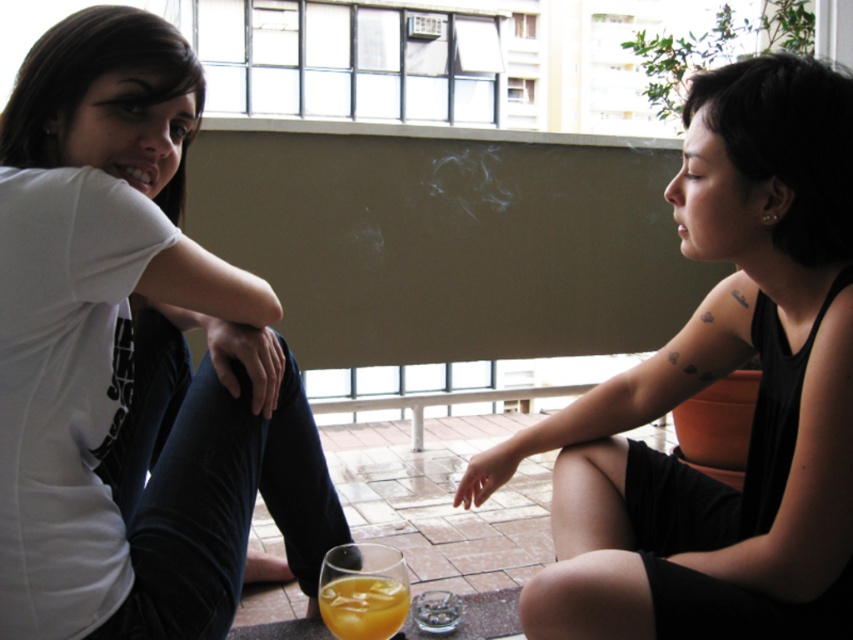
Question: Which of the following is the closest to the observer?

Choices:
 (A) (189, 49)
 (B) (618, 532)
 (C) (372, 577)

Answer: (C)

Question: Which is nearer to the translucent glass of orange juice at lower center?

Choices:
 (A) white matte t-shirt at upper left
 (B) black matte tank top at center

Answer: (A)

Question: Can you confirm if white matte t-shirt at upper left is positioned to the right of translucent glass of orange juice at lower center?

Choices:
 (A) no
 (B) yes

Answer: (A)

Question: Does black matte tank top at center have a smaller size compared to white matte t-shirt at upper left?

Choices:
 (A) no
 (B) yes

Answer: (A)

Question: Can you confirm if black matte tank top at center is positioned to the right of white matte t-shirt at upper left?

Choices:
 (A) no
 (B) yes

Answer: (B)

Question: Which of the following is the farthest from the observer?

Choices:
 (A) (392, 614)
 (B) (28, 620)
 (C) (590, 486)

Answer: (C)